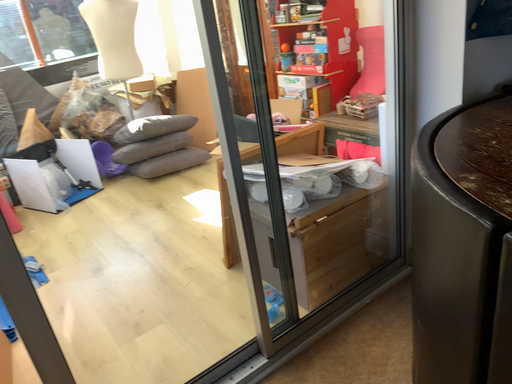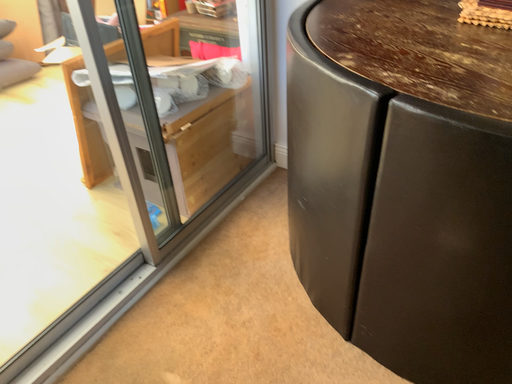
Question: How did the camera likely rotate when shooting the video?

Choices:
 (A) rotated downward
 (B) rotated upward

Answer: (A)